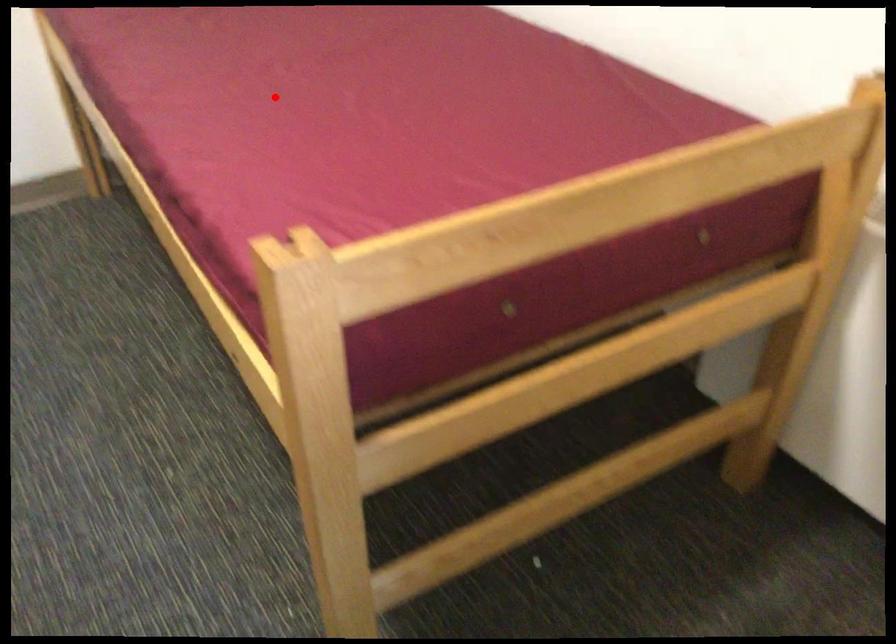
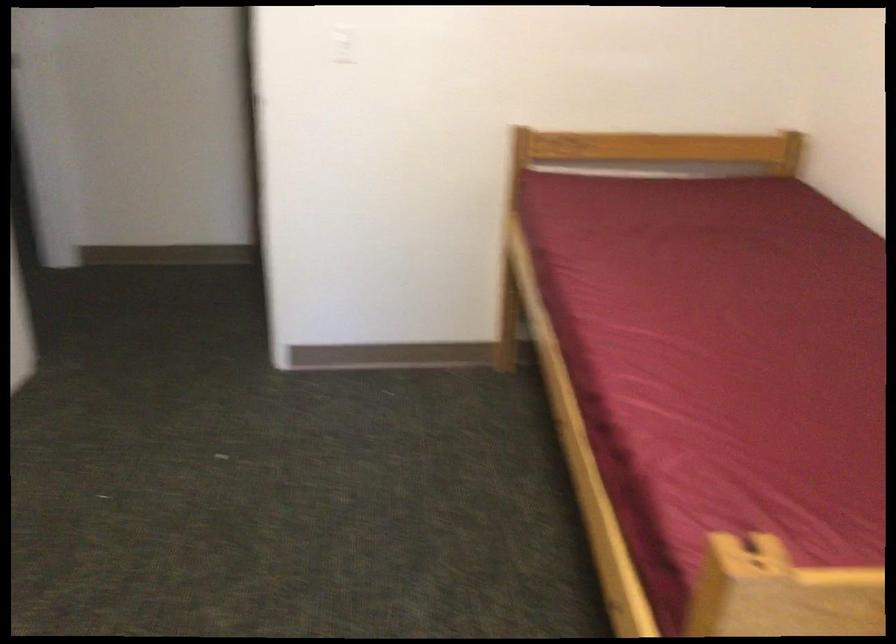
Find the pixel in the second image that matches the highlighted location in the first image.

(719, 348)